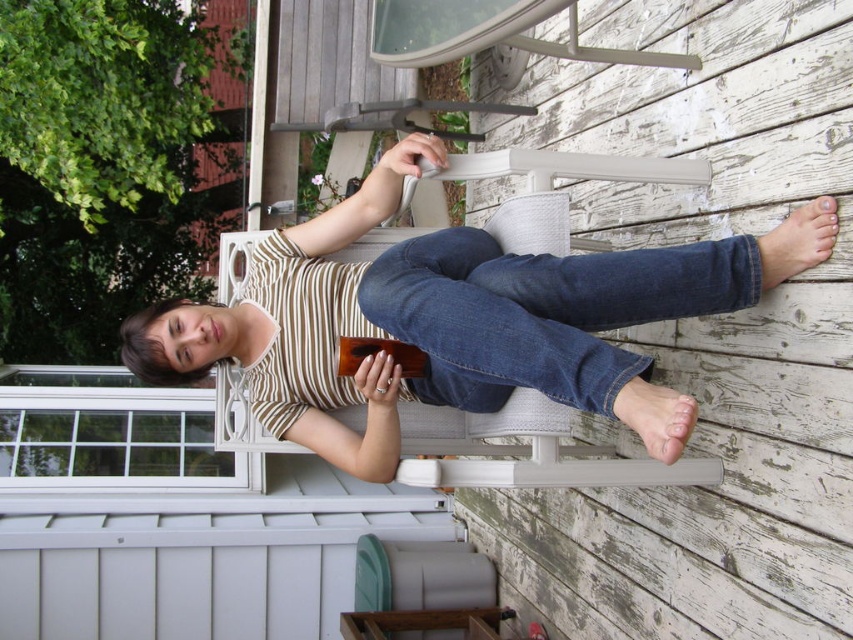
Who is positioned more to the left, striped cotton shirt at center or denim at lower right?

striped cotton shirt at center is more to the left.

Can you confirm if striped cotton shirt at center is thinner than denim at lower right?

In fact, striped cotton shirt at center might be wider than denim at lower right.

Is point (434, 252) positioned before point (543, 273)?

No.

Find the location of a particular element. The width and height of the screenshot is (853, 640). striped cotton shirt at center is located at coordinates (456, 321).